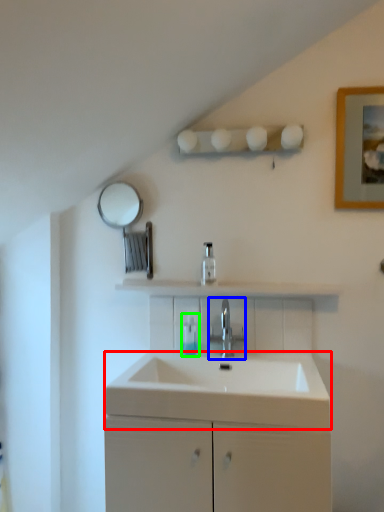
Question: Which object is positioned closest to counter top (highlighted by a red box)? Select from tap (highlighted by a blue box) and toiletry (highlighted by a green box).

Choices:
 (A) tap
 (B) toiletry

Answer: (A)